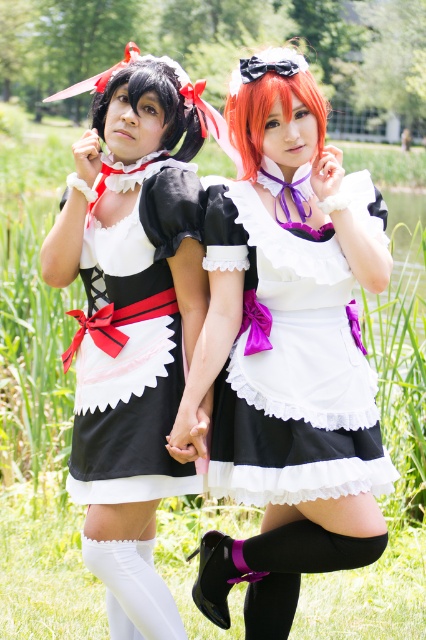
Question: Does white satin dress at center have a greater width compared to matte black dress at left?

Choices:
 (A) no
 (B) yes

Answer: (B)

Question: Is white satin dress at center positioned at the back of matte black dress at left?

Choices:
 (A) no
 (B) yes

Answer: (A)

Question: Can you confirm if white satin dress at center is positioned to the right of matte black dress at center?

Choices:
 (A) yes
 (B) no

Answer: (A)

Question: Which of the following is the farthest from the observer?

Choices:
 (A) matte black dress at center
 (B) matte black dress at left
 (C) white satin dress at center

Answer: (B)

Question: Which object appears farthest from the camera in this image?

Choices:
 (A) matte black dress at left
 (B) matte black dress at center

Answer: (A)

Question: Which object is the farthest from the matte black dress at center?

Choices:
 (A) matte black dress at left
 (B) white satin dress at center

Answer: (B)